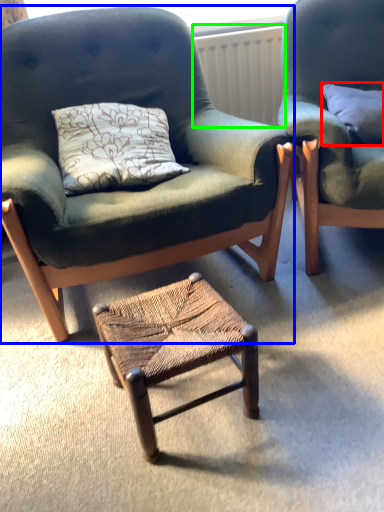
Question: Considering the real-world distances, which object is farthest from pillow (highlighted by a red box)? chair (highlighted by a blue box) or radiator (highlighted by a green box)?

Choices:
 (A) chair
 (B) radiator

Answer: (A)